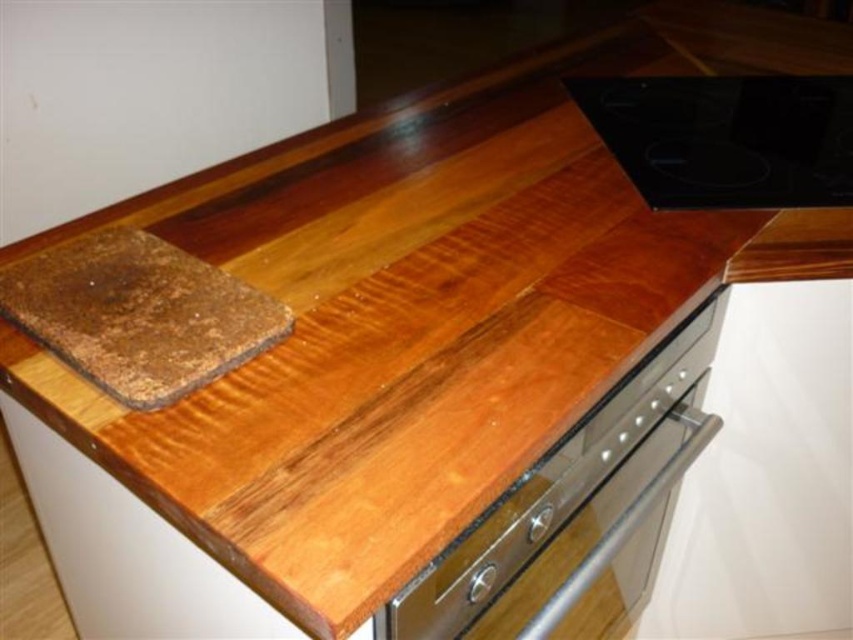
Question: Which of the following is the closest to the observer?

Choices:
 (A) black glass cooktop at upper right
 (B) satin silver oven at lower center

Answer: (B)

Question: Which object appears closest to the camera in this image?

Choices:
 (A) black glass cooktop at upper right
 (B) satin silver oven at lower center

Answer: (B)

Question: Among these objects, which one is farthest from the camera?

Choices:
 (A) satin silver oven at lower center
 (B) black glass cooktop at upper right

Answer: (B)

Question: Is satin silver oven at lower center smaller than black glass cooktop at upper right?

Choices:
 (A) no
 (B) yes

Answer: (A)

Question: Does satin silver oven at lower center appear under black glass cooktop at upper right?

Choices:
 (A) no
 (B) yes

Answer: (B)

Question: Does satin silver oven at lower center have a smaller size compared to black glass cooktop at upper right?

Choices:
 (A) yes
 (B) no

Answer: (B)